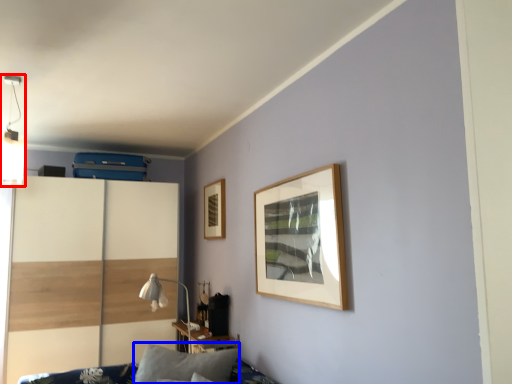
Question: Which object is further to the camera taking this photo, light fixture (highlighted by a red box) or pillow (highlighted by a blue box)?

Choices:
 (A) light fixture
 (B) pillow

Answer: (A)